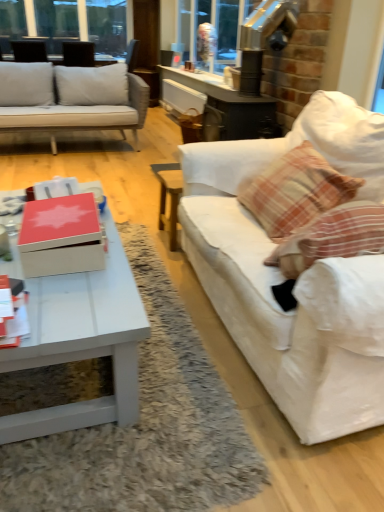
Question: From a real-world perspective, does matte red box at center sit lower than clear glass window at upper left?

Choices:
 (A) yes
 (B) no

Answer: (A)

Question: Does matte red box at center have a greater height compared to clear glass window at upper left?

Choices:
 (A) yes
 (B) no

Answer: (B)

Question: Is clear glass window at upper left a part of matte red box at center?

Choices:
 (A) yes
 (B) no

Answer: (B)

Question: Is the depth of matte red box at center greater than that of clear glass window at upper left?

Choices:
 (A) no
 (B) yes

Answer: (A)

Question: Does matte red box at center have a lesser height compared to clear glass window at upper left?

Choices:
 (A) yes
 (B) no

Answer: (A)

Question: Based on their positions, is plaid fabric pillow at right located to the left or right of matte red box at center?

Choices:
 (A) right
 (B) left

Answer: (A)

Question: Considering the positions of plaid fabric pillow at right and matte red box at center in the image, is plaid fabric pillow at right wider or thinner than matte red box at center?

Choices:
 (A) thin
 (B) wide

Answer: (B)

Question: Is point tap(281, 234) positioned closer to the camera than point tap(66, 252)?

Choices:
 (A) farther
 (B) closer

Answer: (A)

Question: From the image's perspective, is plaid fabric pillow at right located above or below matte red box at center?

Choices:
 (A) above
 (B) below

Answer: (A)

Question: From a real-world perspective, is matte red box at center above or below clear glass window at upper left?

Choices:
 (A) below
 (B) above

Answer: (A)

Question: Is matte red box at center wider or thinner than clear glass window at upper left?

Choices:
 (A) thin
 (B) wide

Answer: (B)

Question: From the image's perspective, is matte red box at center above or below clear glass window at upper left?

Choices:
 (A) below
 (B) above

Answer: (A)

Question: Considering the relative positions of matte red box at center and clear glass window at upper left in the image provided, is matte red box at center to the left or to the right of clear glass window at upper left?

Choices:
 (A) right
 (B) left

Answer: (A)

Question: Based on their sizes in the image, would you say clear glass window at upper left is bigger or smaller than white fabric couch at right?

Choices:
 (A) small
 (B) big

Answer: (A)

Question: Is point pyautogui.click(x=56, y=30) closer or farther from the camera than point pyautogui.click(x=347, y=128)?

Choices:
 (A) closer
 (B) farther

Answer: (B)